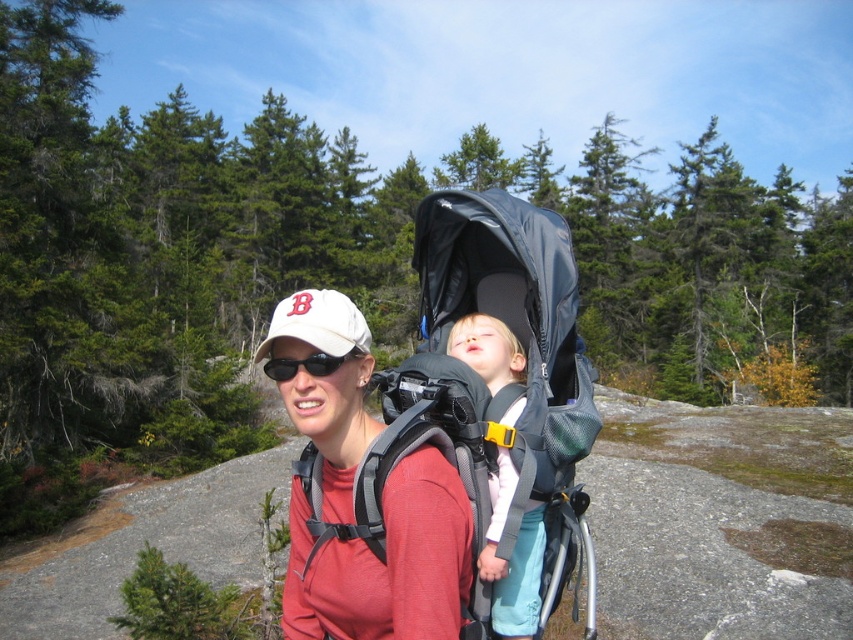
Who is shorter, matte black stroller at center or matte red shirt at center?

matte red shirt at center is shorter.

Is point (426, 342) in front of point (310, 544)?

No.

Where is `matte black stroller at center`? This screenshot has width=853, height=640. matte black stroller at center is located at coordinates (515, 385).

Does matte red shirt at center appear under black matte sunglasses at center?

Incorrect, matte red shirt at center is not positioned below black matte sunglasses at center.

Locate an element on the screen. Image resolution: width=853 pixels, height=640 pixels. matte red shirt at center is located at coordinates (386, 563).

Who is more forward, (361, 342) or (318, 369)?

Point (318, 369)

At what (x,y) coordinates should I click in order to perform the action: click on matte red shirt at center. Please return your answer as a coordinate pair (x, y). Image resolution: width=853 pixels, height=640 pixels. Looking at the image, I should click on (386, 563).

Which is below, matte black stroller at center or white matte baseball cap at center?

matte black stroller at center is lower down.

Can you confirm if matte black stroller at center is positioned above white matte baseball cap at center?

Incorrect, matte black stroller at center is not positioned above white matte baseball cap at center.

Does point (589, 582) lie behind point (310, 301)?

That is True.

Find the location of a particular element. matte black stroller at center is located at coordinates (515, 385).